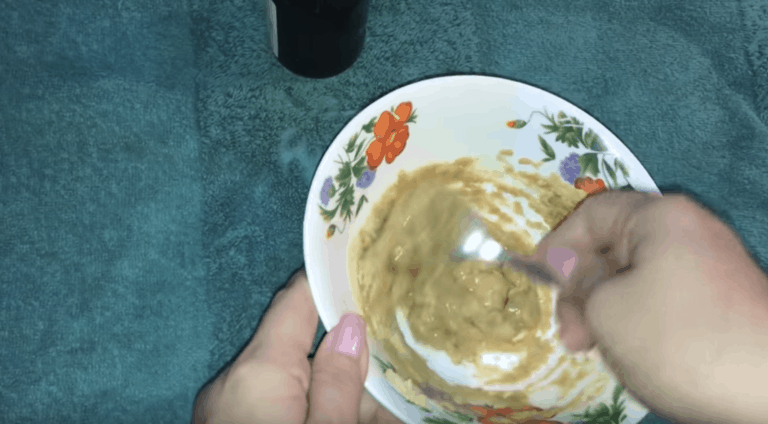
The width and height of the screenshot is (768, 424). In order to click on spoon in this screenshot , I will do `click(472, 240)`.